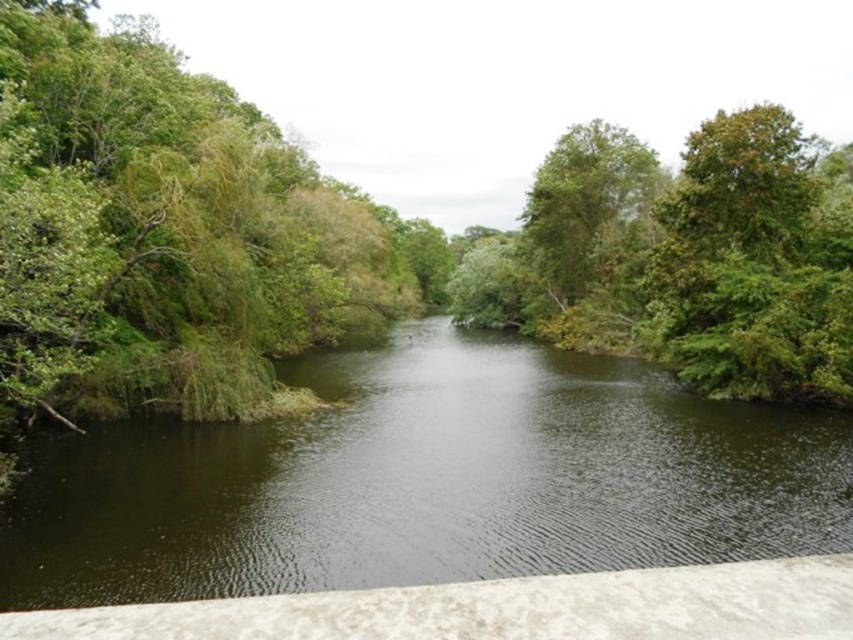
Question: Is dark green water at center to the left of green leafy tree at upper right from the viewer's perspective?

Choices:
 (A) yes
 (B) no

Answer: (A)

Question: Is dark green water at center bigger than green leafy tree at upper right?

Choices:
 (A) no
 (B) yes

Answer: (A)

Question: Which point is closer to the camera taking this photo?

Choices:
 (A) (419, 419)
 (B) (529, 253)

Answer: (A)

Question: Does dark green water at center appear under green leafy tree at upper right?

Choices:
 (A) no
 (B) yes

Answer: (B)

Question: Which point is closer to the camera taking this photo?

Choices:
 (A) (544, 512)
 (B) (543, 252)

Answer: (A)

Question: Which point is closer to the camera?

Choices:
 (A) green leafy tree at upper right
 (B) dark green water at center

Answer: (B)